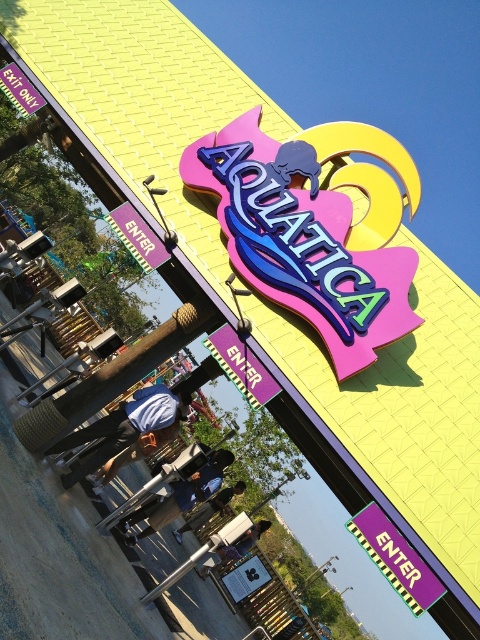
Question: In this image, where is glossy plastic aquatica sign at center located relative to purple glossy sign at center?

Choices:
 (A) below
 (B) above

Answer: (B)

Question: Which of the following is the closest to the observer?

Choices:
 (A) glossy plastic aquatica sign at center
 (B) purple glossy sign at center

Answer: (B)

Question: Is glossy plastic aquatica sign at center below purple glossy sign at center?

Choices:
 (A) yes
 (B) no

Answer: (B)

Question: Which of the following is the closest to the observer?

Choices:
 (A) glossy plastic aquatica sign at center
 (B) purple glossy sign at center

Answer: (B)

Question: Which point is farther from the camera taking this photo?

Choices:
 (A) (265, 177)
 (B) (375, 560)

Answer: (A)

Question: Is glossy plastic aquatica sign at center below purple glossy sign at center?

Choices:
 (A) no
 (B) yes

Answer: (A)